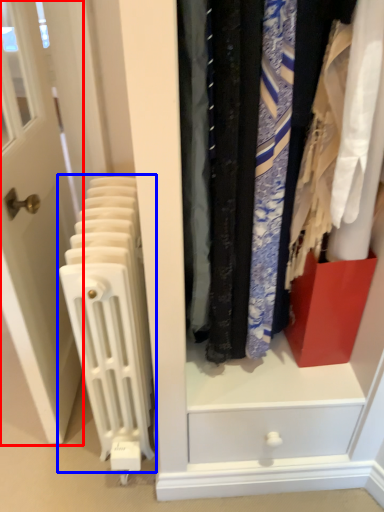
Question: Which object appears closest to the camera in this image, door (highlighted by a red box) or radiator (highlighted by a blue box)?

Choices:
 (A) door
 (B) radiator

Answer: (A)